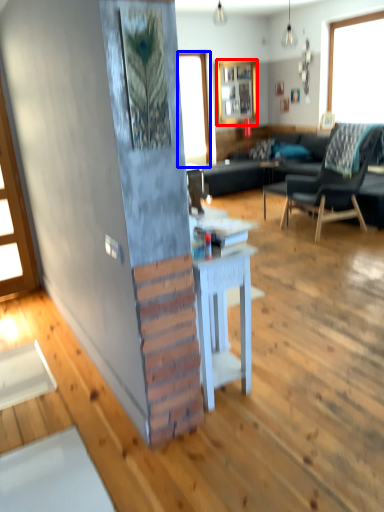
Question: Which object is further to the camera taking this photo, cabinetry (highlighted by a red box) or window (highlighted by a blue box)?

Choices:
 (A) cabinetry
 (B) window

Answer: (A)